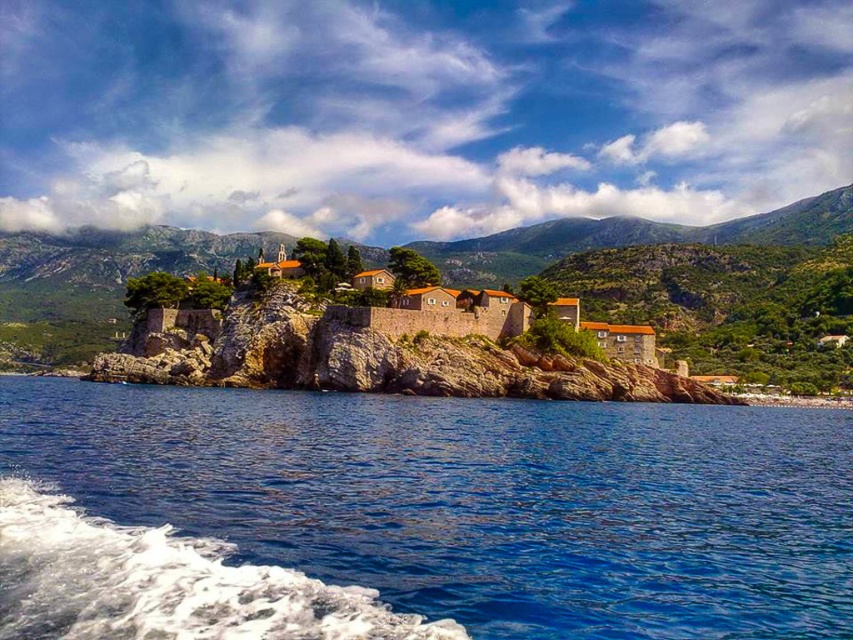
You are a photographer planning to capture the entire scene in one shot. Given that the blue liquid water at lower left and the brown stone mountain at center are both in the frame, which object will occupy more of the photo?

The brown stone mountain at center will occupy more of the photo because it is larger in size compared to the blue liquid water at lower left.

You are a hiker planning to cross from the blue liquid water at lower left to the brown stone mountain at center. Based on the scene, which direction should you move to reach the mountain?

The blue liquid water at lower left is positioned on the right side of brown stone mountain at center, so to reach the mountain, you should move to the left.

You are standing at the edge of the coastal scene and want to reach the brown stone mountain at center. Which direction should you move to get closer to it, considering the blue liquid water at lower left is in your current line of sight?

You should move away from the blue liquid water at lower left because it is closer to you than the brown stone mountain at center, so moving in the opposite direction would bring you nearer to the mountain.